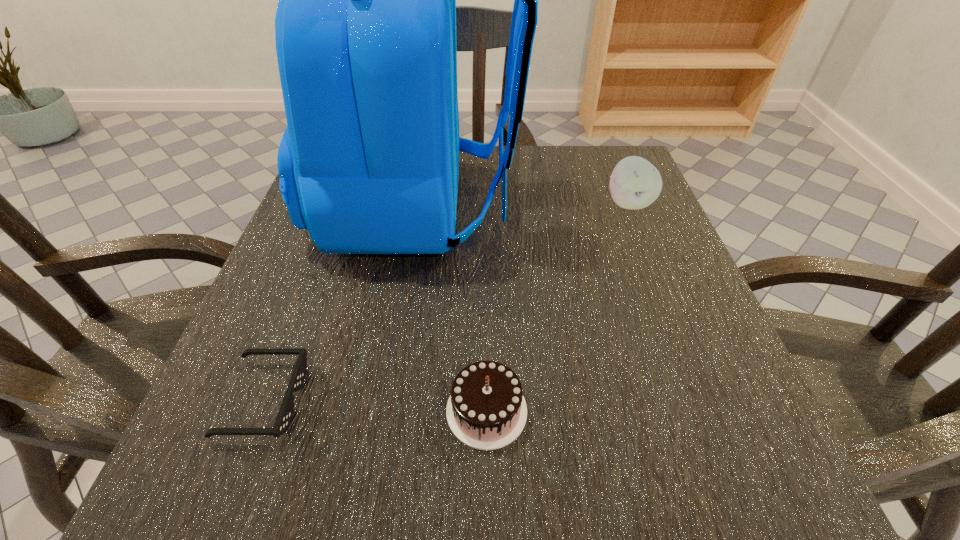
Image resolution: width=960 pixels, height=540 pixels. In order to click on apple that is positioned at the far edge in this screenshot , I will do `click(635, 183)`.

This screenshot has width=960, height=540. I want to click on chocolate cake at the near edge, so click(x=486, y=410).

Image resolution: width=960 pixels, height=540 pixels. What are the coordinates of `sunglasses that is positioned at the near edge` in the screenshot? It's located at (285, 414).

Identify the location of backpack that is at the left edge. (365, 28).

The image size is (960, 540). Find the location of `sunglasses that is positioned at the left edge`. sunglasses that is positioned at the left edge is located at coordinates (285, 414).

Where is `object that is at the right edge`? The width and height of the screenshot is (960, 540). object that is at the right edge is located at coordinates (635, 183).

Locate an element on the screen. This screenshot has width=960, height=540. object at the far left corner is located at coordinates (365, 28).

This screenshot has width=960, height=540. I want to click on object located at the near left corner, so click(x=285, y=414).

The width and height of the screenshot is (960, 540). Find the location of `object that is at the far right corner`. object that is at the far right corner is located at coordinates (635, 183).

Locate an element on the screen. free space at the far edge is located at coordinates (523, 147).